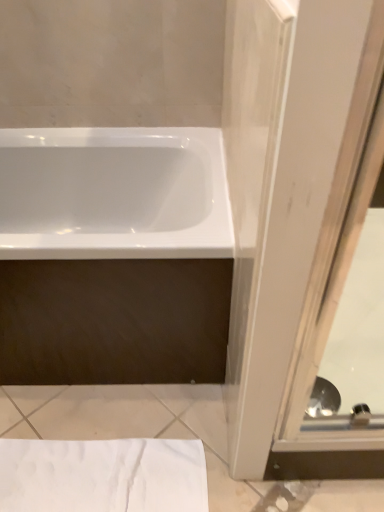
What do you see at coordinates (103, 475) in the screenshot?
I see `white textured towel at lower left` at bounding box center [103, 475].

You are a GUI agent. You are given a task and a screenshot of the screen. Output one action in this format:
    pyautogui.click(x=<x>, y=<y>)
    Task: Click on the clear glass screen door at right
    
    Given the screenshot: What is the action you would take?
    pyautogui.click(x=296, y=219)

Locate an element on the screen. white glossy bathtub at center is located at coordinates (114, 193).

In order to click on white textured towel at lower left in this screenshot , I will do tap(103, 475).

Which of these two, white textured towel at lower left or white glossy bathtub at center, stands taller?

Standing taller between the two is white glossy bathtub at center.

Looking at this image, is white textured towel at lower left smaller than white glossy bathtub at center?

Yes.

Looking at their sizes, would you say white textured towel at lower left is wider or thinner than white glossy bathtub at center?

Clearly, white textured towel at lower left has less width compared to white glossy bathtub at center.

Can you confirm if white textured towel at lower left is shorter than clear glass screen door at right?

Indeed, white textured towel at lower left has a lesser height compared to clear glass screen door at right.

Is white textured towel at lower left aimed at clear glass screen door at right?

No.

Is clear glass screen door at right not near white textured towel at lower left?

clear glass screen door at right is near white textured towel at lower left, not far away.

Can you tell me how much clear glass screen door at right and white textured towel at lower left differ in facing direction?

They differ by 0.000757 degrees in their facing directions.

At what (x,y) coordinates should I click in order to perform the action: click on screen door located in front of the white textured towel at lower left. Please return your answer as a coordinate pair (x, y). The image size is (384, 512). Looking at the image, I should click on [x=296, y=219].

Which object is positioned more to the left, clear glass screen door at right or white textured towel at lower left?

Positioned to the left is white textured towel at lower left.

Image resolution: width=384 pixels, height=512 pixels. What are the coordinates of `bathtub above the clear glass screen door at right (from the image's perspective)` in the screenshot? It's located at (114, 193).

From the picture: Is clear glass screen door at right situated inside white glossy bathtub at center or outside?

clear glass screen door at right is not inside white glossy bathtub at center, it's outside.

Is clear glass screen door at right at the left side of white glossy bathtub at center?

In fact, clear glass screen door at right is to the right of white glossy bathtub at center.

In the scene shown: Is white glossy bathtub at center positioned far away from clear glass screen door at right?

white glossy bathtub at center is actually quite close to clear glass screen door at right.

What's the angular difference between white glossy bathtub at center and clear glass screen door at right's facing directions?

They differ by 0.000337 degrees in their facing directions.

Could clear glass screen door at right be considered to be inside white glossy bathtub at center?

No, clear glass screen door at right is located outside of white glossy bathtub at center.

In terms of size, does white glossy bathtub at center appear bigger or smaller than clear glass screen door at right?

Clearly, white glossy bathtub at center is larger in size than clear glass screen door at right.

From the image's perspective, is white glossy bathtub at center located beneath white textured towel at lower left?

No, from the image's perspective, white glossy bathtub at center is not below white textured towel at lower left.

Consider the image. Looking at their sizes, would you say white glossy bathtub at center is wider or thinner than white textured towel at lower left?

Considering their sizes, white glossy bathtub at center looks broader than white textured towel at lower left.

In the scene shown: Is the position of white glossy bathtub at center less distant than that of white textured towel at lower left?

That is True.

Locate an element on the screen. sheet below the white glossy bathtub at center (from a real-world perspective) is located at coordinates (103, 475).

The height and width of the screenshot is (512, 384). Identify the location of bathtub above the white textured towel at lower left (from a real-world perspective). (114, 193).

What are the coordinates of `screen door lying above the white textured towel at lower left (from the image's perspective)` in the screenshot? It's located at (296, 219).

When comparing their distances from clear glass screen door at right, does white glossy bathtub at center or white textured towel at lower left seem further?

white textured towel at lower left lies further to clear glass screen door at right than the other object.

Considering their positions, is white textured towel at lower left positioned closer to clear glass screen door at right than white glossy bathtub at center?

white glossy bathtub at center is positioned closer to the anchor clear glass screen door at right.

Based on their spatial positions, is white glossy bathtub at center or clear glass screen door at right closer to white textured towel at lower left?

clear glass screen door at right.

Estimate the real-world distances between objects in this image. Which object is closer to white textured towel at lower left, clear glass screen door at right or white glossy bathtub at center?

clear glass screen door at right lies closer to white textured towel at lower left than the other object.

From the image, which object appears to be farther from white glossy bathtub at center, clear glass screen door at right or white textured towel at lower left?

The object further to white glossy bathtub at center is white textured towel at lower left.

Considering their positions, is white textured towel at lower left positioned closer to white glossy bathtub at center than clear glass screen door at right?

The object closer to white glossy bathtub at center is clear glass screen door at right.

This screenshot has width=384, height=512. Identify the location of sheet situated between white glossy bathtub at center and clear glass screen door at right from left to right. (103, 475).